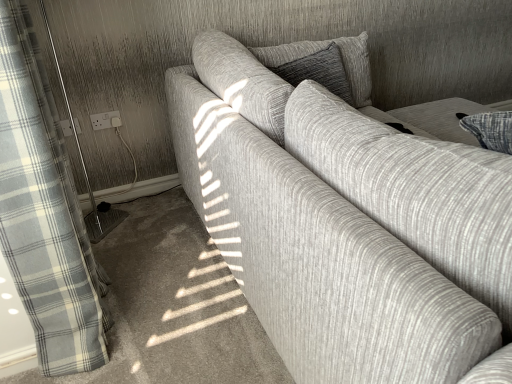
Question: Relative to white plastic socket at upper left, which appears as the first electric outlet when viewed from the right, is white textured screen door at left in front or behind?

Choices:
 (A) front
 (B) behind

Answer: (A)

Question: In the image, is white textured screen door at left on the left side or the right side of white plastic socket at upper left, which appears as the first electric outlet when viewed from the right?

Choices:
 (A) right
 (B) left

Answer: (B)

Question: Estimate the real-world distances between objects in this image. Which object is closer to the white plastic socket at upper left, acting as the second electric outlet starting from the left?

Choices:
 (A) textured gray pillow at center
 (B) white plastic socket at lower left, which is counted as the 2th electric outlet, starting from the right
 (C) white checkered fabric at left
 (D) white textured screen door at left
 (E) textured gray couch at center

Answer: (B)

Question: Considering the real-world distances, which object is closest to the textured gray pillow at center?

Choices:
 (A) white textured screen door at left
 (B) white plastic socket at lower left, which is counted as the 2th electric outlet, starting from the right
 (C) white plastic socket at upper left, which appears as the first electric outlet when viewed from the right
 (D) textured gray couch at center
 (E) white checkered fabric at left

Answer: (D)